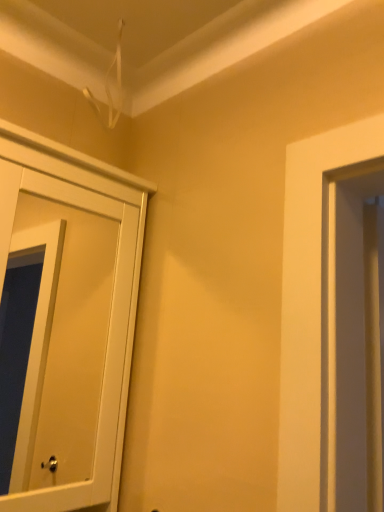
Image resolution: width=384 pixels, height=512 pixels. Describe the element at coordinates (70, 322) in the screenshot. I see `white matte cupboard at left` at that location.

In the scene shown: Measure the distance between white matte cupboard at left and camera.

white matte cupboard at left is 84.35 centimeters away from camera.

At what (x,y) coordinates should I click in order to perform the action: click on white matte cupboard at left. Please return your answer as a coordinate pair (x, y). Image resolution: width=384 pixels, height=512 pixels. Looking at the image, I should click on tap(70, 322).

Find the location of a particular element. white matte cupboard at left is located at coordinates (70, 322).